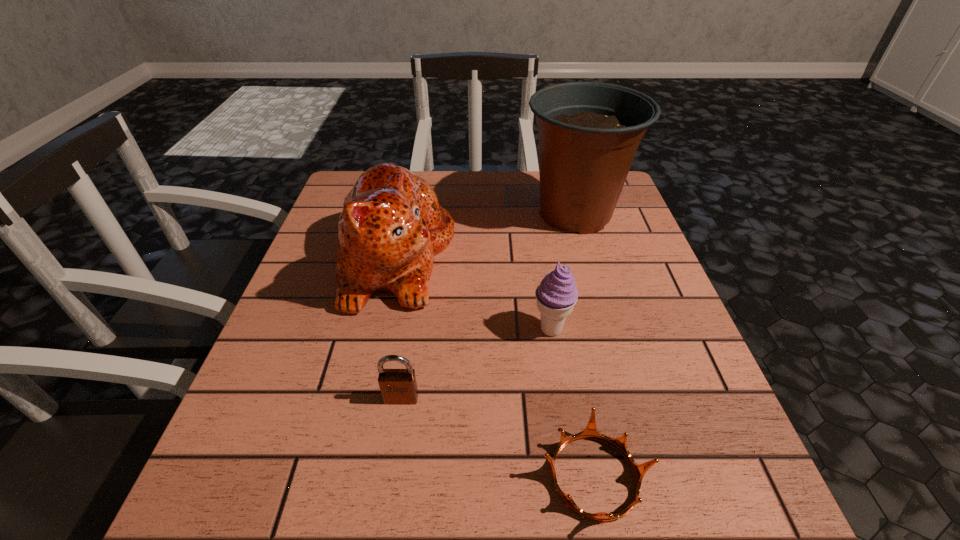
Find the location of a particular element. vacant area situated on the front-facing side of the padlock is located at coordinates (396, 433).

Identify the location of blank area located on the back of the crown. (553, 263).

Where is `flowerpot that is at the far edge`? flowerpot that is at the far edge is located at coordinates (589, 132).

Find the location of a particular element. This screenshot has width=960, height=540. cat present at the far edge is located at coordinates (391, 226).

This screenshot has width=960, height=540. I want to click on object positioned at the near edge, so click(590, 432).

Locate an element on the screen. The image size is (960, 540). object located in the left edge section of the desktop is located at coordinates point(391,226).

This screenshot has width=960, height=540. In order to click on flowerpot situated at the right edge in this screenshot , I will do `click(589, 132)`.

Identify the location of crown located at the right edge. The image size is (960, 540). (590, 432).

Identify the location of object situated at the far left corner. This screenshot has height=540, width=960. (391, 226).

Find the location of a particular element. object located in the far right corner section of the desktop is located at coordinates (589, 132).